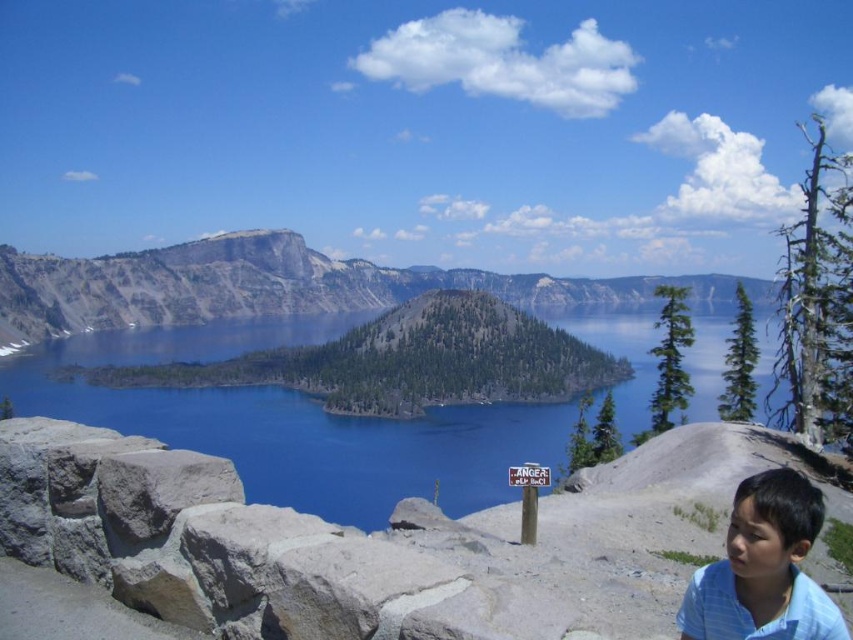
You are standing at point (762, 593) and want to walk to the point (131, 307). According to the scene description, will you be moving towards the foreground or background of the image?

Point (131, 307) is behind point (762, 593), so moving from (762, 593) to (131, 307) means you are moving towards the background of the image.

Based on the coordinates provided in the description, where is the gray rock formation at center located in the image?

The gray rock formation at center is located at point coordinates of (270, 285).